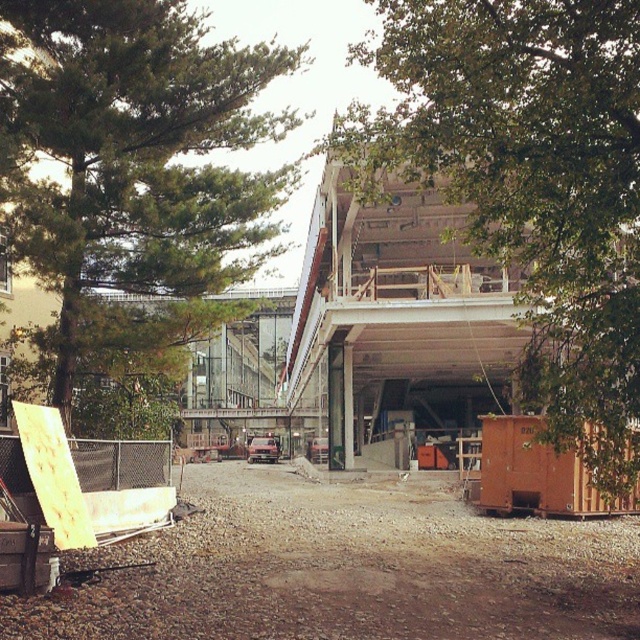
You are standing at point A, which is at coordinates (529, 186). Looking around, you see a green leafy tree at upper right. Can you tell me what is located at your current position?

At point (529, 186) lies green leafy tree at upper right.

You are standing at the construction site and want to plant a new tree. The green leafy tree at upper right is already present. If you want to plant a new tree 12 meters away from the existing one, where should you place it?

The green leafy tree at upper right is 10.32 meters away from the viewer. To plant a new tree 12 meters away from it, you should place the new tree 12 meters further from the existing tree in the desired direction while ensuring it is within the construction site boundaries.

You are standing at the construction site and want to move from the point at coordinates (445, 88) to the point at coordinates (220, 195). Which direction should you move to reach your destination?

To move from point (445, 88) to point (220, 195), you should move towards the lower right direction since point (220, 195) is located below and to the right of point (445, 88).